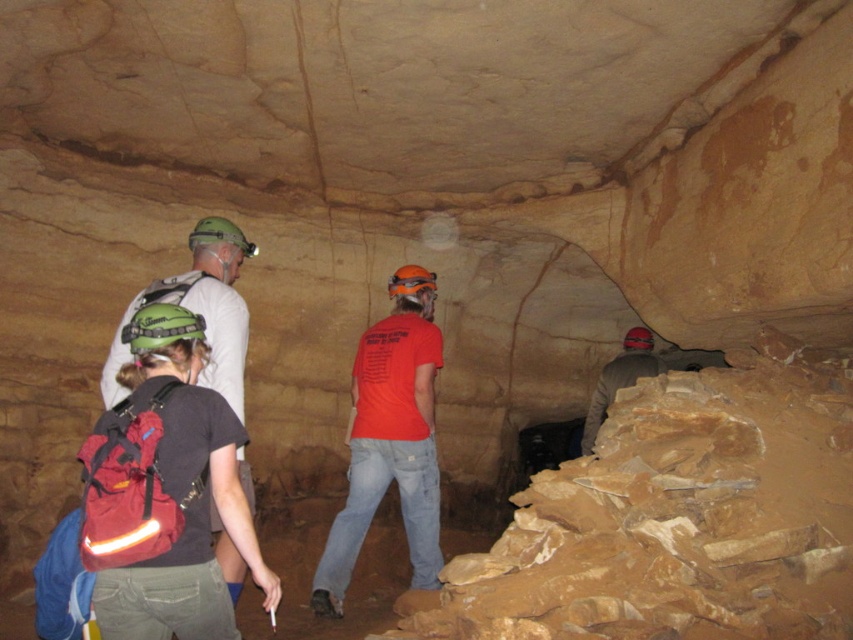
Question: Is orange fabric shirt at center positioned at the back of matte green helmet at upper left?

Choices:
 (A) no
 (B) yes

Answer: (B)

Question: Is the position of orange fabric shirt at center more distant than that of matte green helmet at upper left?

Choices:
 (A) yes
 (B) no

Answer: (A)

Question: Which point is closer to the camera?

Choices:
 (A) matte green helmet at upper left
 (B) orange fabric shirt at center

Answer: (A)

Question: Considering the real-world distances, which object is farthest from the matte gray jacket at right?

Choices:
 (A) orange fabric shirt at center
 (B) matte green helmet at upper left

Answer: (B)

Question: Does matte green helmet at upper left lie in front of matte gray jacket at right?

Choices:
 (A) no
 (B) yes

Answer: (B)

Question: Which point is farther to the camera?

Choices:
 (A) tap(233, 252)
 (B) tap(656, 369)

Answer: (B)